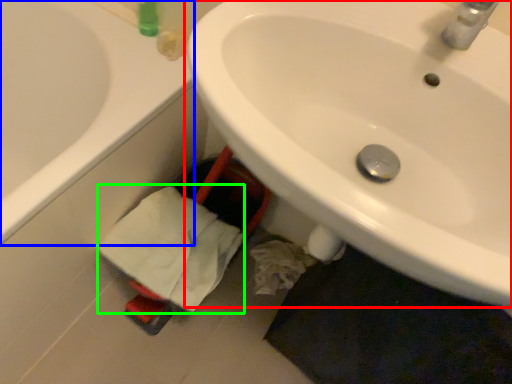
Question: Considering the real-world distances, which object is closest to sink (highlighted by a red box)? bathtub (highlighted by a blue box) or bath towel (highlighted by a green box).

Choices:
 (A) bathtub
 (B) bath towel

Answer: (B)